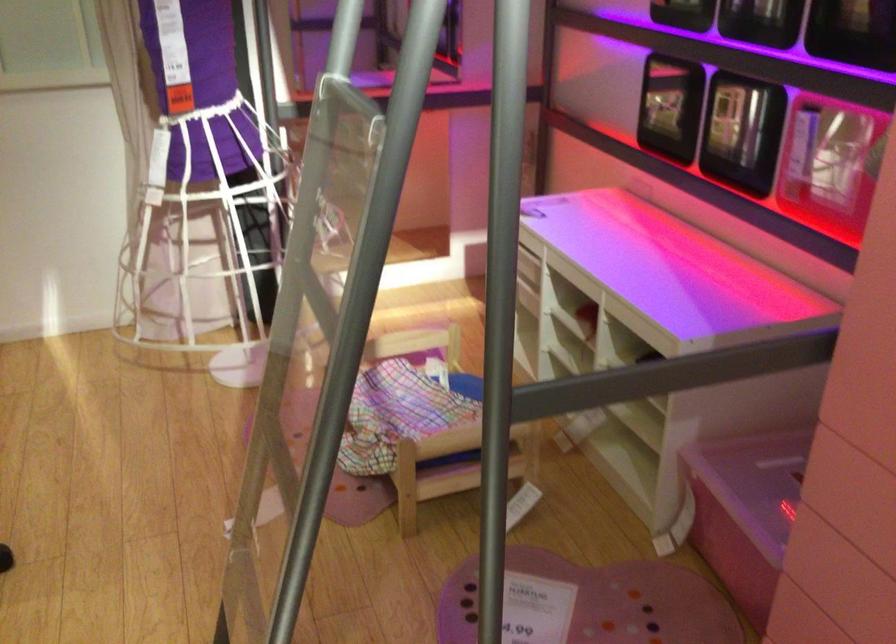
Question: The camera is either moving clockwise (left) or counter-clockwise (right) around the object. The first image is from the beginning of the video and the second image is from the end. Is the camera moving left or right when shooting the video?

Choices:
 (A) Left
 (B) Right

Answer: (B)